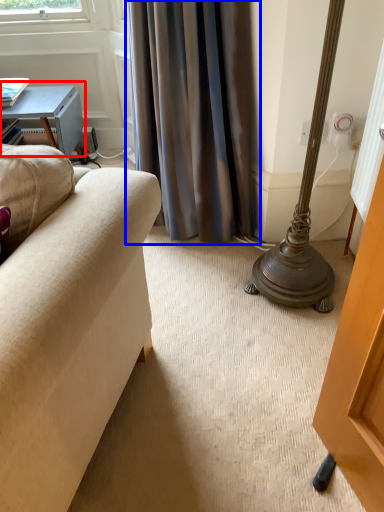
Question: Among these objects, which one is farthest to the camera, table (highlighted by a red box) or curtain (highlighted by a blue box)?

Choices:
 (A) table
 (B) curtain

Answer: (A)